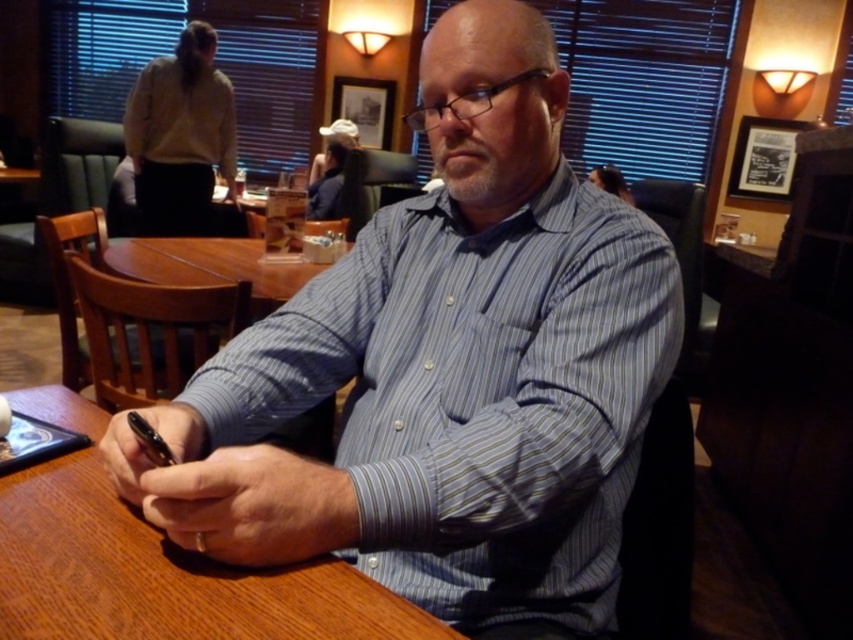
You are a server in a restaurant and need to deliver a drink to a customer seated at the wooden table at center. The drink must be placed exactly 25 centimeters away from the blue striped shirt at center to avoid spilling. Can you place the drink in the required position?

The blue striped shirt at center and wooden table at center are 24.48 centimeters apart from each other. Since the required distance is 25 centimeters, the drink cannot be placed exactly at the required distance because the existing distance between them is slightly shorter.